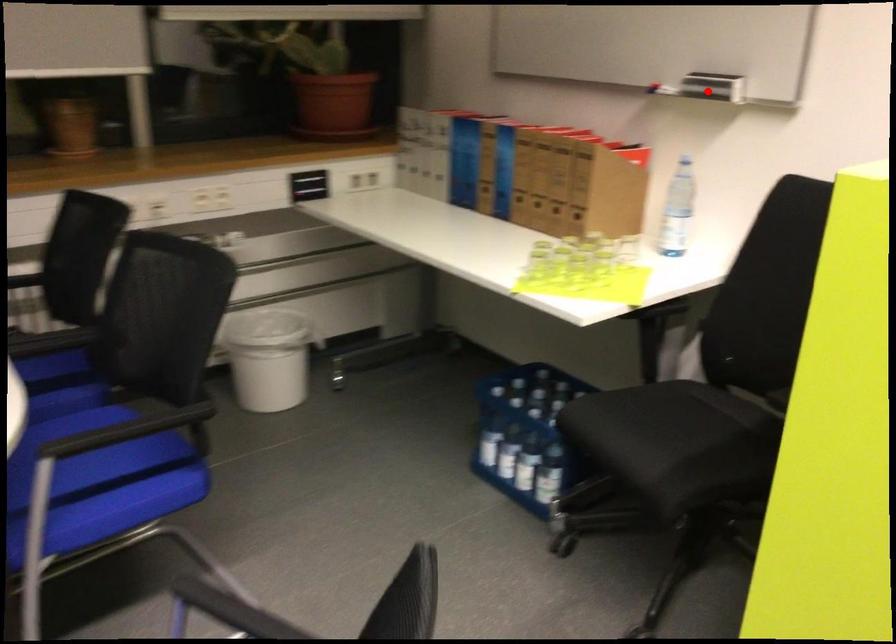
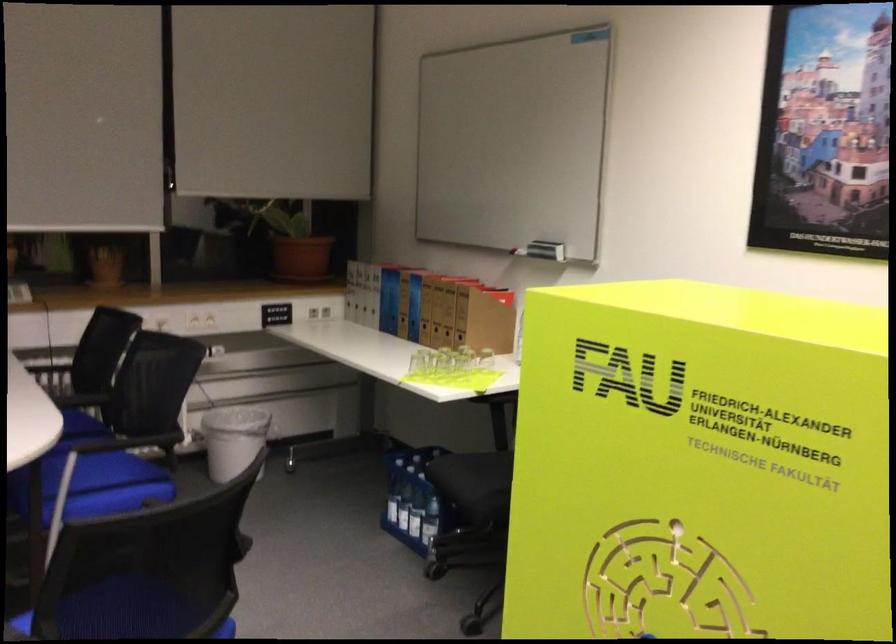
Question: I am providing you with two images of the same scene from different viewpoints. Image1 has a red point marked. In image2, the corresponding 3D location appears at what relative position? Reply with the corresponding letter.

Choices:
 (A) Closer
 (B) Farther

Answer: (B)